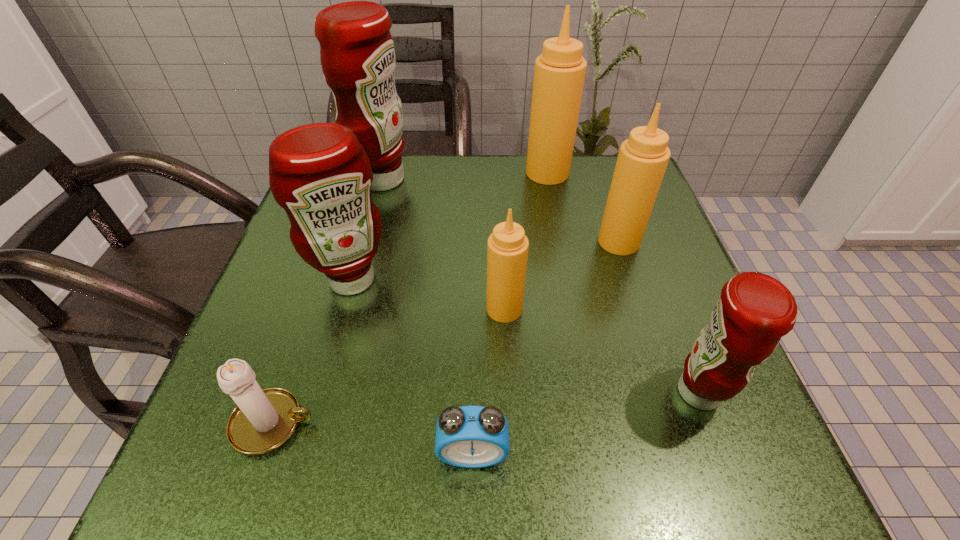
Identify the location of vacant area that lies between the smallest tan condiment and the biggest red condiment. (444, 244).

Locate an element on the screen. free space that is in between the rightmost red condiment and the biggest tan condiment is located at coordinates (623, 282).

Point out which object is positioned as the fourth nearest to the sixth object from left to right. Please provide its 2D coordinates. Your answer should be formatted as a tuple, i.e. [(x, y)], where the tuple contains the x and y coordinates of a point satisfying the conditions above.

[(319, 173)]

At what (x,y) coordinates should I click in order to perform the action: click on object that is the fifth closest one to the seventh tallest object. Please return your answer as a coordinate pair (x, y). The width and height of the screenshot is (960, 540). Looking at the image, I should click on (755, 310).

Identify which condiment is the fifth closest to the second biggest red condiment. Please provide its 2D coordinates. Your answer should be formatted as a tuple, i.e. [(x, y)], where the tuple contains the x and y coordinates of a point satisfying the conditions above.

[(755, 310)]

Identify the location of condiment that stands as the fifth closest to the seventh tallest object. (643, 158).

Identify which tan condiment is the second closest to the farthest tan condiment. Please provide its 2D coordinates. Your answer should be formatted as a tuple, i.e. [(x, y)], where the tuple contains the x and y coordinates of a point satisfying the conditions above.

[(507, 250)]

Select which tan condiment is the second closest to the rightmost red condiment. Please provide its 2D coordinates. Your answer should be formatted as a tuple, i.e. [(x, y)], where the tuple contains the x and y coordinates of a point satisfying the conditions above.

[(643, 158)]

Locate an element on the screen. The width and height of the screenshot is (960, 540). the closest red condiment to the smallest tan condiment is located at coordinates (319, 173).

The image size is (960, 540). In order to click on red condiment that stands as the closest to the smallest tan condiment in this screenshot , I will do `click(319, 173)`.